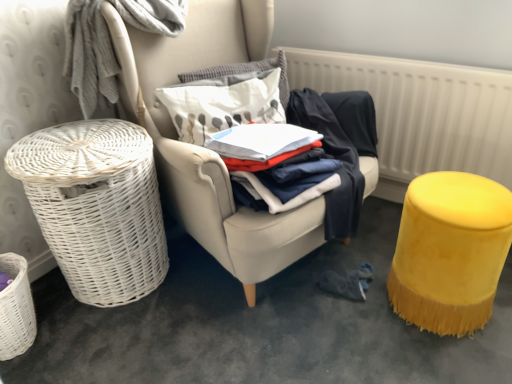
What is the approximate height of white wicker basket at left?

white wicker basket at left is 38.90 inches tall.

Locate an element on the screen. white wicker laundry basket at left is located at coordinates (260, 325).

In the scene shown: In order to face yellow velvet stool at right, should I rotate leftwards or rightwards?

Rotate right and turn 23.997 degrees.

What do you see at coordinates (336, 157) in the screenshot? The width and height of the screenshot is (512, 384). I see `white cotton shirt at center` at bounding box center [336, 157].

The image size is (512, 384). Identify the location of white cotton shirt at center. (336, 157).

Measure the distance between point (x=276, y=66) and camera.

A distance of 5.63 feet exists between point (x=276, y=66) and camera.

What is the approximate width of white fabric pillow at center, arranged as the first pillow when ordered from the bottom?

white fabric pillow at center, arranged as the first pillow when ordered from the bottom, is 8.97 inches wide.

The width and height of the screenshot is (512, 384). What do you see at coordinates (422, 110) in the screenshot?
I see `white textured radiator at upper right` at bounding box center [422, 110].

In order to face white wicker basket at left, should I rotate leftwards or rightwards?

To align with it, rotate left about 20.114°.

You are a GUI agent. You are given a task and a screenshot of the screen. Output one action in this format:
    pyautogui.click(x=<x>, y=<y>)
    Task: Click on the white wicker basket at left
    
    Given the screenshot: What is the action you would take?
    pyautogui.click(x=207, y=150)

Is the position of white textured radiator at upper right less distant than that of white wicker basket at left?

No, it is not.

Considering the relative sizes of white textured radiator at upper right and white wicker basket at left in the image provided, is white textured radiator at upper right smaller than white wicker basket at left?

Indeed, white textured radiator at upper right has a smaller size compared to white wicker basket at left.

Is white textured radiator at upper right spatially inside white wicker basket at left, or outside of it?

The correct answer is: outside.

Is white textured radiator at upper right wider than white wicker basket at left?

In fact, white textured radiator at upper right might be narrower than white wicker basket at left.

Considering the sizes of objects white textured pillow at center, which ranks as the first pillow in top-to-bottom order, and white cotton shirt at center in the image provided, who is shorter, white textured pillow at center, which ranks as the first pillow in top-to-bottom order, or white cotton shirt at center?

With less height is white textured pillow at center, which ranks as the first pillow in top-to-bottom order.

How distant is white textured pillow at center, which ranks as the first pillow in top-to-bottom order, from white cotton shirt at center?

white textured pillow at center, which ranks as the first pillow in top-to-bottom order, is 11.93 inches away from white cotton shirt at center.

From the picture: Is white textured pillow at center, which ranks as the first pillow in top-to-bottom order, positioned with its back to white cotton shirt at center?

No.

Is white textured pillow at center, which is counted as the 2th pillow, starting from the bottom, situated inside white cotton shirt at center or outside?

The correct answer is: outside.

Is white cotton shirt at center looking in the opposite direction of yellow velvet stool at right?

No, yellow velvet stool at right is not at the back of white cotton shirt at center.

From the image's perspective, is white cotton shirt at center located beneath yellow velvet stool at right?

No, from the image's perspective, white cotton shirt at center is not beneath yellow velvet stool at right.

Is point (351, 148) positioned after point (502, 186)?

That is True.

Which object is wider, white cotton shirt at center or yellow velvet stool at right?

white cotton shirt at center is wider.

Is white wicker basket at left at the back of white fabric pillow at center, arranged as the first pillow when ordered from the bottom?

No, white fabric pillow at center, arranged as the first pillow when ordered from the bottom, is not facing away from white wicker basket at left.

Is white fabric pillow at center, which is the 2th pillow from top to bottom, next to white wicker basket at left and touching it?

white fabric pillow at center, which is the 2th pillow from top to bottom, and white wicker basket at left are clearly separated.

At what (x,y) coordinates should I click in order to perform the action: click on basket located underneath the white fabric pillow at center, arranged as the first pillow when ordered from the bottom (from a real-world perspective). Please return your answer as a coordinate pair (x, y). Image resolution: width=512 pixels, height=384 pixels. Looking at the image, I should click on (96, 206).

Between white fabric pillow at center, arranged as the first pillow when ordered from the bottom, and white wicker basket at left, which one appears on the right side from the viewer's perspective?

white fabric pillow at center, arranged as the first pillow when ordered from the bottom.

I want to click on radiator directly beneath the white wicker basket at left (from a real-world perspective), so click(422, 110).

Considering the positions of point (428, 155) and point (204, 206), is point (428, 155) closer or farther from the camera than point (204, 206)?

Point (428, 155) is positioned farther from the camera compared to point (204, 206).

Does white textured radiator at upper right contain white wicker basket at left?

No.

From a real-world perspective, is white textured radiator at upper right physically above white wicker basket at left?

No, from a real-world perspective, white textured radiator at upper right is not on top of white wicker basket at left.

What's the angular difference between white wicker basket at left and white textured radiator at upper right's facing directions?

69.8 degrees.

Is white wicker basket at left taller than white textured radiator at upper right?

Correct, white wicker basket at left is much taller as white textured radiator at upper right.

Considering the relative positions of white wicker basket at left and white textured radiator at upper right in the image provided, is white wicker basket at left in front of white textured radiator at upper right?

Yes, it is.

I want to click on radiator on the right of white wicker basket at left, so click(x=422, y=110).

Which of these two, white textured pillow at center, which is counted as the 2th pillow, starting from the bottom, or white wicker laundry basket at left, stands shorter?

With less height is white wicker laundry basket at left.

Can you confirm if white textured pillow at center, which is counted as the 2th pillow, starting from the bottom, is bigger than white wicker laundry basket at left?

No, white textured pillow at center, which is counted as the 2th pillow, starting from the bottom, is not bigger than white wicker laundry basket at left.

From the image's perspective, is white textured pillow at center, which ranks as the first pillow in top-to-bottom order, on white wicker laundry basket at left?

Yes, from the image's perspective, white textured pillow at center, which ranks as the first pillow in top-to-bottom order, is on top of white wicker laundry basket at left.

Image resolution: width=512 pixels, height=384 pixels. I want to click on concrete in front of the white textured pillow at center, which is counted as the 2th pillow, starting from the bottom, so click(260, 325).

The image size is (512, 384). Identify the location of radiator above the white wicker basket at left (from a real-world perspective). (422, 110).

Locate an element on the screen. This screenshot has width=512, height=384. clothing that is in front of the white textured pillow at center, which ranks as the first pillow in top-to-bottom order is located at coordinates (336, 157).

When comparing their distances from white fabric pillow at center, which is the 2th pillow from top to bottom, does yellow velvet stool at right or white wicker laundry basket at left seem further?

The object further to white fabric pillow at center, which is the 2th pillow from top to bottom, is yellow velvet stool at right.

Estimate the real-world distances between objects in this image. Which object is further from white wicker basket at left, white textured pillow at center, which ranks as the first pillow in top-to-bottom order, or yellow velvet stool at right?

The object further to white wicker basket at left is yellow velvet stool at right.

Based on their spatial positions, is yellow velvet stool at right or white fabric pillow at center, which is the 2th pillow from top to bottom, closer to white textured radiator at upper right?

Among the two, yellow velvet stool at right is located nearer to white textured radiator at upper right.

From the image, which object appears to be farther from white wicker basket at left, white cotton shirt at center or white fabric pillow at center, which is the 2th pillow from top to bottom?

white cotton shirt at center.

Based on the photo, estimate the real-world distances between objects in this image. Which object is further from white wicker basket at left, white textured pillow at center, which is counted as the 2th pillow, starting from the bottom, or white wicker laundry basket at left?

white textured pillow at center, which is counted as the 2th pillow, starting from the bottom.

Based on their spatial positions, is white fabric pillow at center, arranged as the first pillow when ordered from the bottom, or white textured radiator at upper right closer to white wicker laundry basket at left?

white fabric pillow at center, arranged as the first pillow when ordered from the bottom.

From the image, which object appears to be nearer to white wicker basket at left, white textured pillow at center, which ranks as the first pillow in top-to-bottom order, or white wicker basket at left?

white wicker basket at left lies closer to white wicker basket at left than the other object.

Based on their spatial positions, is white textured pillow at center, which ranks as the first pillow in top-to-bottom order, or white wicker laundry basket at left closer to white cotton shirt at center?

white textured pillow at center, which ranks as the first pillow in top-to-bottom order.

You are a GUI agent. You are given a task and a screenshot of the screen. Output one action in this format:
    pyautogui.click(x=<x>, y=<y>)
    Task: Click on the pillow between white wicker basket at left and white textured pillow at center, which ranks as the first pillow in top-to-bottom order, along the z-axis
    
    Given the screenshot: What is the action you would take?
    (223, 103)

In order to click on basket positioned between white wicker laundry basket at left and white fabric pillow at center, arranged as the first pillow when ordered from the bottom, from near to far in this screenshot , I will do `click(96, 206)`.

Where is `radiator between white wicker basket at left and white textured pillow at center, which is counted as the 2th pillow, starting from the bottom, in the front-back direction`? The height and width of the screenshot is (384, 512). radiator between white wicker basket at left and white textured pillow at center, which is counted as the 2th pillow, starting from the bottom, in the front-back direction is located at coordinates (422, 110).

Where is `concrete situated between white fabric pillow at center, arranged as the first pillow when ordered from the bottom, and yellow velvet stool at right from left to right`? The height and width of the screenshot is (384, 512). concrete situated between white fabric pillow at center, arranged as the first pillow when ordered from the bottom, and yellow velvet stool at right from left to right is located at coordinates coord(260,325).